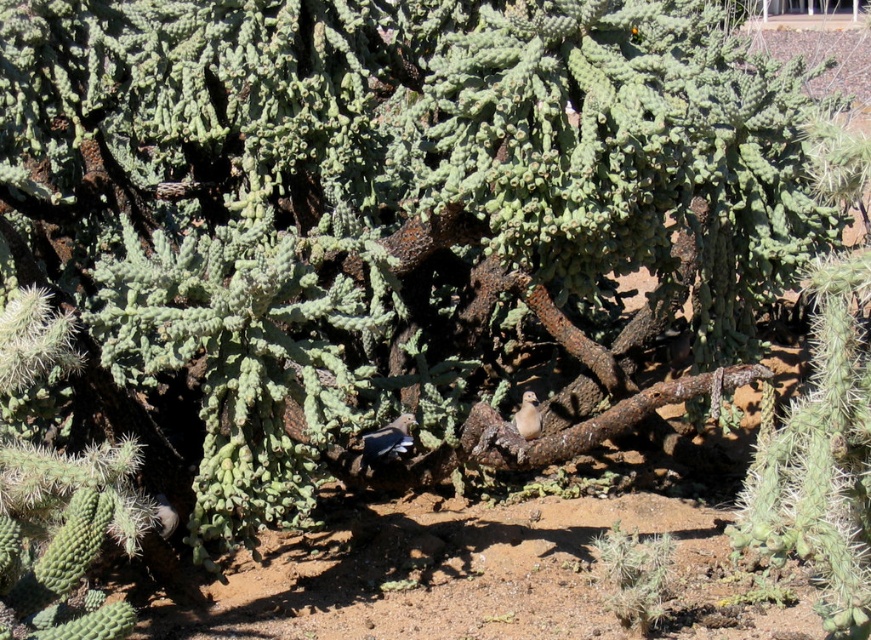
Who is taller, dark gray feathers at center or light brown feathered bird at center?

With more height is dark gray feathers at center.

Can you confirm if dark gray feathers at center is positioned to the right of light brown feathered bird at center?

In fact, dark gray feathers at center is to the left of light brown feathered bird at center.

Where is `dark gray feathers at center`? The width and height of the screenshot is (871, 640). dark gray feathers at center is located at coordinates (388, 440).

Where is `dark gray feathers at center`? This screenshot has width=871, height=640. dark gray feathers at center is located at coordinates (388, 440).

Is the position of rusty metal branch at center more distant than that of light brown feathered bird at center?

No.

Who is positioned more to the right, rusty metal branch at center or light brown feathered bird at center?

Positioned to the right is rusty metal branch at center.

Is point (568, 440) positioned before point (537, 428)?

Yes, it is.

The width and height of the screenshot is (871, 640). In order to click on rusty metal branch at center in this screenshot , I will do `click(591, 420)`.

Is rusty metal branch at center to the left of dark gray feathers at center from the viewer's perspective?

Incorrect, rusty metal branch at center is not on the left side of dark gray feathers at center.

Which of these two, rusty metal branch at center or dark gray feathers at center, stands taller?

Standing taller between the two is rusty metal branch at center.

Which is in front, point (576, 428) or point (377, 451)?

Point (576, 428)

The width and height of the screenshot is (871, 640). In order to click on rusty metal branch at center in this screenshot , I will do `click(591, 420)`.